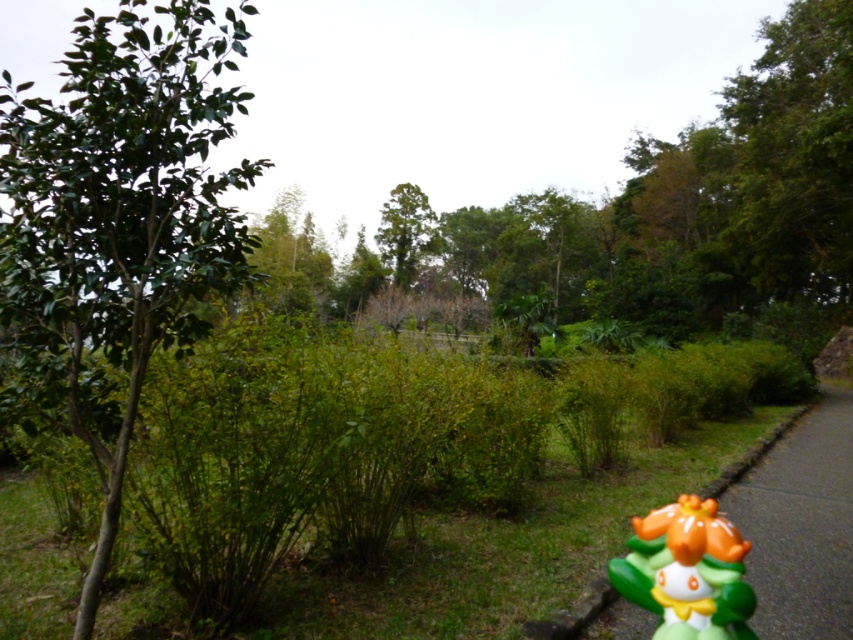
Question: Does green leafy tree at left have a smaller size compared to green rubber toy at lower right?

Choices:
 (A) yes
 (B) no

Answer: (B)

Question: Observing the image, what is the correct spatial positioning of green leafy tree at left in reference to green rubber curb at lower right?

Choices:
 (A) below
 (B) above

Answer: (B)

Question: Considering the real-world distances, which object is farthest from the green leafy tree at center?

Choices:
 (A) green leafy tree at upper center
 (B) green leafy tree at left
 (C) green rubber curb at lower right
 (D) green rubber toy at lower right

Answer: (D)

Question: Which of the following is the closest to the observer?

Choices:
 (A) click(x=187, y=104)
 (B) click(x=607, y=598)

Answer: (A)

Question: Is green leafy tree at left thinner than green leafy tree at center?

Choices:
 (A) no
 (B) yes

Answer: (A)

Question: Which object is closer to the camera taking this photo?

Choices:
 (A) green leafy tree at upper center
 (B) green rubber toy at lower right
 (C) green rubber curb at lower right
 (D) green leafy tree at center

Answer: (B)